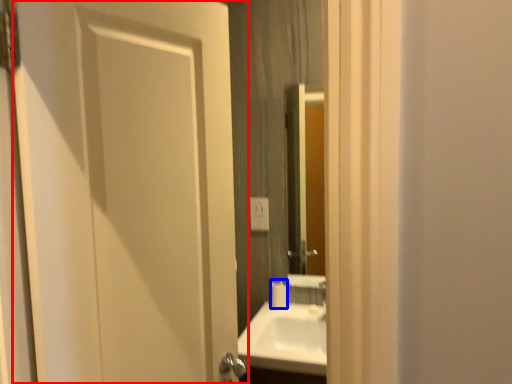
Question: Which of the following is the farthest to the observer, door (highlighted by a red box) or toilet paper (highlighted by a blue box)?

Choices:
 (A) door
 (B) toilet paper

Answer: (B)